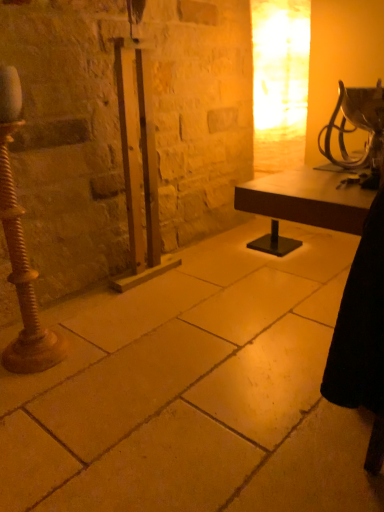
Question: From a real-world perspective, is smooth stone floor at center physically above metallic silver table lamp at upper right?

Choices:
 (A) no
 (B) yes

Answer: (A)

Question: Considering the relative sizes of smooth stone floor at center and metallic silver table lamp at upper right in the image provided, is smooth stone floor at center smaller than metallic silver table lamp at upper right?

Choices:
 (A) yes
 (B) no

Answer: (B)

Question: Is smooth stone floor at center aimed at metallic silver table lamp at upper right?

Choices:
 (A) no
 (B) yes

Answer: (A)

Question: Is there a large distance between smooth stone floor at center and metallic silver table lamp at upper right?

Choices:
 (A) no
 (B) yes

Answer: (A)

Question: From the image's perspective, is smooth stone floor at center above metallic silver table lamp at upper right?

Choices:
 (A) yes
 (B) no

Answer: (B)

Question: Looking at their shapes, would you say metallic silver table lamp at upper right is wider or thinner than rusty metal pole at left?

Choices:
 (A) thin
 (B) wide

Answer: (B)

Question: Would you say metallic silver table lamp at upper right is to the left or to the right of rusty metal pole at left in the picture?

Choices:
 (A) left
 (B) right

Answer: (B)

Question: In terms of height, does metallic silver table lamp at upper right look taller or shorter compared to rusty metal pole at left?

Choices:
 (A) short
 (B) tall

Answer: (A)

Question: From the image's perspective, relative to rusty metal pole at left, is metallic silver table lamp at upper right above or below?

Choices:
 (A) above
 (B) below

Answer: (A)

Question: Considering the relative positions of rusty metal pole at left and smooth stone floor at center in the image provided, is rusty metal pole at left to the left or to the right of smooth stone floor at center?

Choices:
 (A) right
 (B) left

Answer: (B)

Question: Does point (26, 295) appear closer or farther from the camera than point (243, 497)?

Choices:
 (A) farther
 (B) closer

Answer: (A)

Question: Relative to smooth stone floor at center, is rusty metal pole at left in front or behind?

Choices:
 (A) behind
 (B) front

Answer: (A)

Question: From a real-world perspective, is rusty metal pole at left physically located above or below smooth stone floor at center?

Choices:
 (A) above
 (B) below

Answer: (A)

Question: From a real-world perspective, is smooth stone floor at center positioned above or below rusty metal pole at left?

Choices:
 (A) above
 (B) below

Answer: (B)

Question: Visually, is smooth stone floor at center positioned to the left or to the right of rusty metal pole at left?

Choices:
 (A) right
 (B) left

Answer: (A)